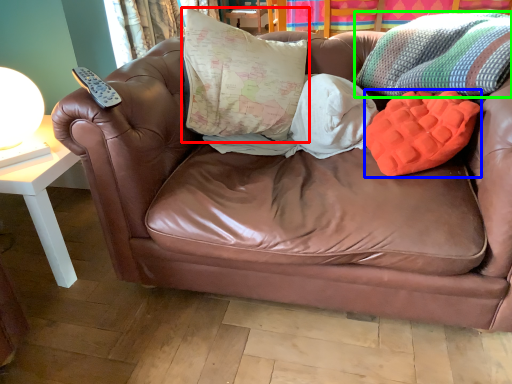
Question: Based on their relative distances, which object is farther from pillow (highlighted by a red box)? Choose from pillow (highlighted by a blue box) and throw pillow (highlighted by a green box).

Choices:
 (A) pillow
 (B) throw pillow

Answer: (A)